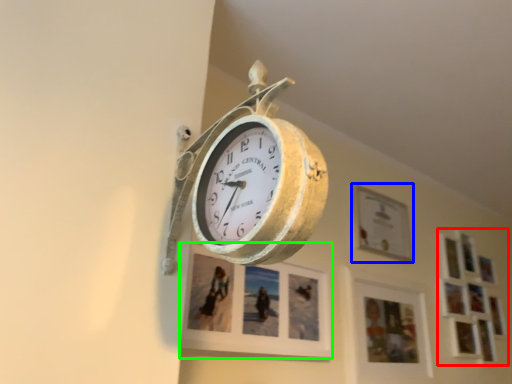
Question: Based on their relative distances, which object is nearer to picture frame (highlighted by a red box)? Choose from picture frame (highlighted by a blue box) and picture frame (highlighted by a green box).

Choices:
 (A) picture frame
 (B) picture frame

Answer: (A)